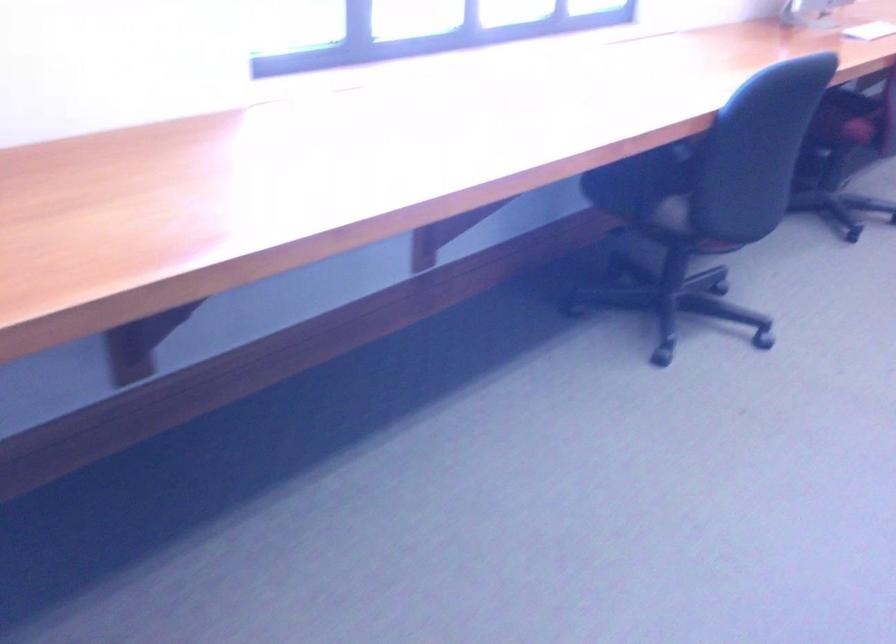
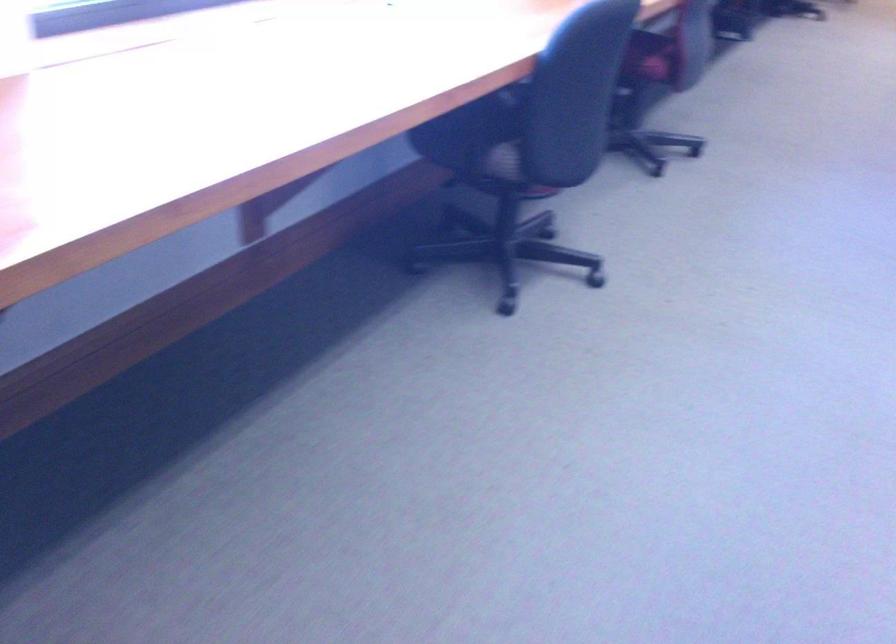
Question: The first image is from the beginning of the video and the second image is from the end. How did the camera likely rotate when shooting the video?

Choices:
 (A) Left
 (B) Right
 (C) Up
 (D) Down

Answer: (B)